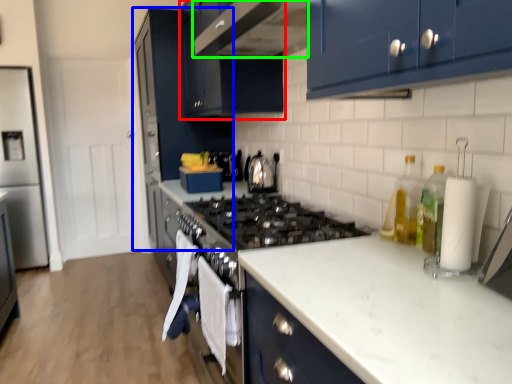
Question: Considering the real-world distances, which object is farthest from cabinetry (highlighted by a red box)? cabinetry (highlighted by a blue box) or home appliance (highlighted by a green box)?

Choices:
 (A) cabinetry
 (B) home appliance

Answer: (A)